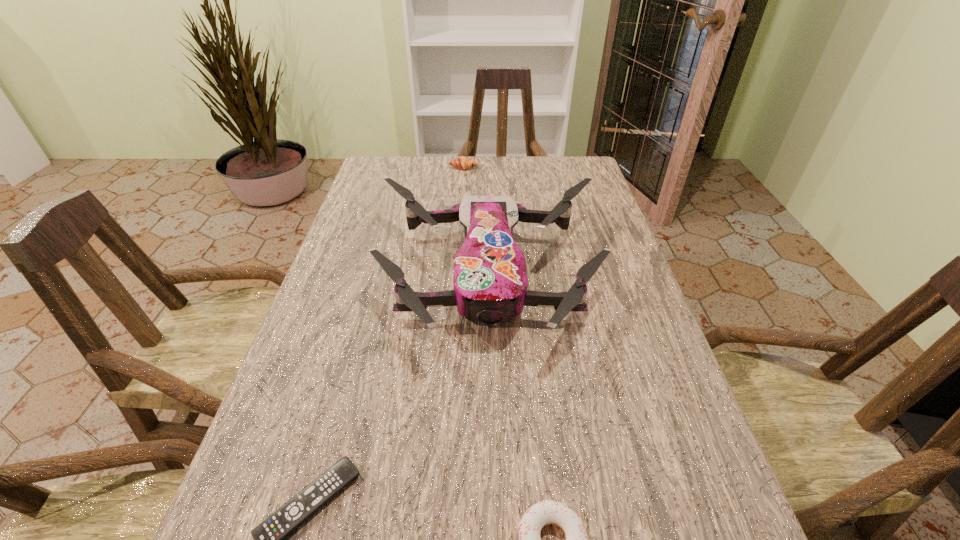
In the image, there is a desktop. Where is `vacant area at the left edge`? This screenshot has height=540, width=960. vacant area at the left edge is located at coordinates (354, 214).

What are the coordinates of `vacant space at the right edge` in the screenshot? It's located at (564, 262).

This screenshot has width=960, height=540. Find the location of `free spot at the far left corner of the desktop`. free spot at the far left corner of the desktop is located at coordinates (398, 168).

Where is `vacant space at the far right corner of the desktop`? Image resolution: width=960 pixels, height=540 pixels. vacant space at the far right corner of the desktop is located at coordinates (563, 190).

Select which object is the second closest to the second farthest object. Please provide its 2D coordinates. Your answer should be formatted as a tuple, i.e. [(x, y)], where the tuple contains the x and y coordinates of a point satisfying the conditions above.

[(464, 163)]

Locate which object is the third closest to the drone. Please provide its 2D coordinates. Your answer should be formatted as a tuple, i.e. [(x, y)], where the tuple contains the x and y coordinates of a point satisfying the conditions above.

[(542, 513)]